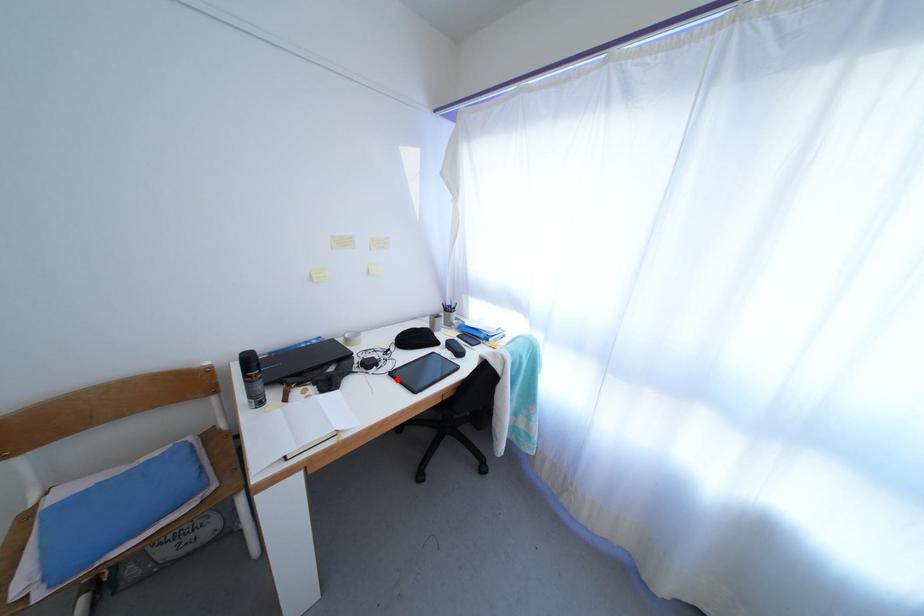
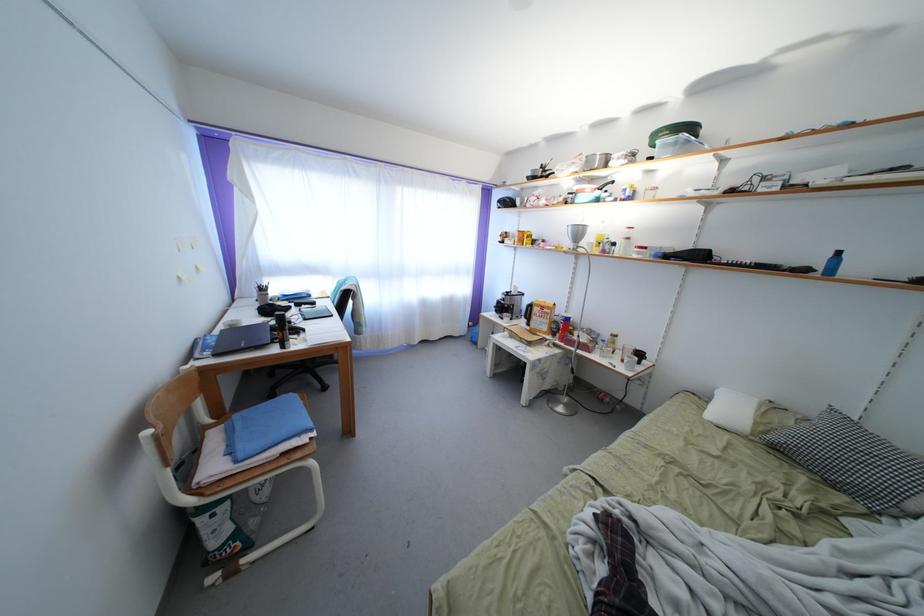
Question: I am providing you with two images of the same scene from different viewpoints. A red point is marked on the first image. At the location where the point appears in image 1, is it still visible in image 2?

Choices:
 (A) Yes
 (B) No

Answer: (B)